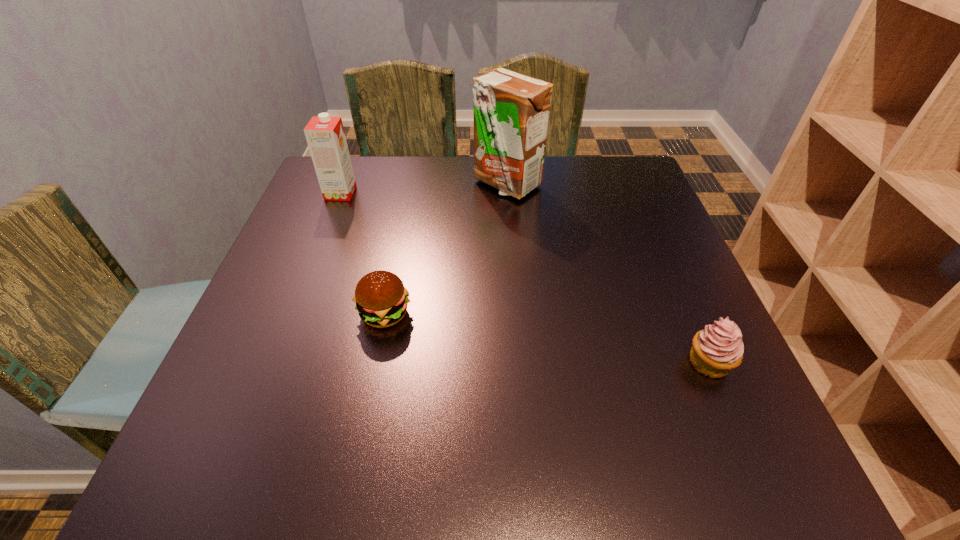
You are a GUI agent. You are given a task and a screenshot of the screen. Output one action in this format:
    pyautogui.click(x=<x>, y=<y>)
    Task: Click on the free location located 0.170m on the left of the rightmost object
    This screenshot has width=960, height=540.
    Given the screenshot: What is the action you would take?
    pyautogui.click(x=590, y=362)

Identify the location of vacant space situated 0.300m on the right of the third farthest object. (564, 314).

Find the location of a particular element. This screenshot has height=540, width=960. object that is positioned at the left edge is located at coordinates (325, 135).

The width and height of the screenshot is (960, 540). Identify the location of object located in the right edge section of the desktop. (718, 349).

You are a GUI agent. You are given a task and a screenshot of the screen. Output one action in this format:
    pyautogui.click(x=<x>, y=<y>)
    Task: Click on the object situated at the far left corner
    The image size is (960, 540).
    Given the screenshot: What is the action you would take?
    [325, 135]

This screenshot has height=540, width=960. In order to click on free location at the far edge of the desktop in this screenshot , I will do `click(557, 179)`.

Where is `vacant space at the near edge of the desktop`? The width and height of the screenshot is (960, 540). vacant space at the near edge of the desktop is located at coordinates (475, 461).

You are a GUI agent. You are given a task and a screenshot of the screen. Output one action in this format:
    pyautogui.click(x=<x>, y=<y>)
    Task: Click on the free space at the left edge of the desktop
    
    Given the screenshot: What is the action you would take?
    pyautogui.click(x=254, y=305)

I want to click on vacant region at the right edge of the desktop, so click(684, 370).

In the image, there is a desktop. Find the location of `vacant space at the far left corner`. vacant space at the far left corner is located at coordinates pyautogui.click(x=351, y=160).